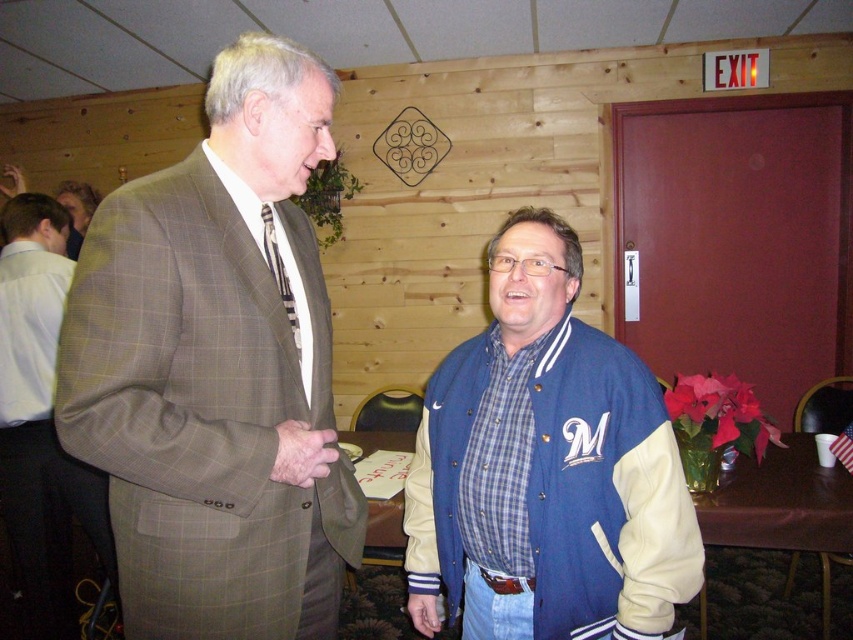
Consider the image. Can you confirm if blue/white varsity jacket at center is thinner than light brown suit at left?

Indeed, blue/white varsity jacket at center has a lesser width compared to light brown suit at left.

Can you confirm if blue/white varsity jacket at center is positioned above light brown suit at left?

Incorrect, blue/white varsity jacket at center is not positioned above light brown suit at left.

Between point (497, 372) and point (85, 230), which one is positioned behind?

The point (85, 230) is behind.

The image size is (853, 640). Find the location of `blue/white varsity jacket at center`. blue/white varsity jacket at center is located at coordinates (546, 467).

Can you confirm if plaid wool suit at center is shorter than blue/white varsity jacket at center?

In fact, plaid wool suit at center may be taller than blue/white varsity jacket at center.

From the picture: Who is shorter, plaid wool suit at center or blue/white varsity jacket at center?

blue/white varsity jacket at center

This screenshot has width=853, height=640. Describe the element at coordinates (218, 369) in the screenshot. I see `plaid wool suit at center` at that location.

At what (x,y) coordinates should I click in order to perform the action: click on plaid wool suit at center. Please return your answer as a coordinate pair (x, y). The image size is (853, 640). Looking at the image, I should click on (218, 369).

Between matte gray suit at left and light brown suit at left, which one is positioned higher?

light brown suit at left

Is matte gray suit at left above light brown suit at left?

No, matte gray suit at left is not above light brown suit at left.

Who is more forward, (38,509) or (70,241)?

Point (38,509)

Find the location of a particular element. The height and width of the screenshot is (640, 853). matte gray suit at left is located at coordinates (39, 410).